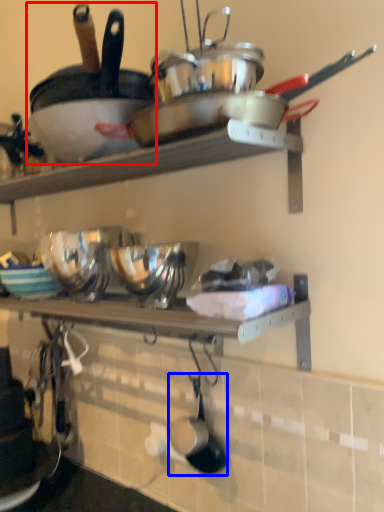
Question: Which object is closer to the camera taking this photo, frying pan (highlighted by a red box) or frying pan (highlighted by a blue box)?

Choices:
 (A) frying pan
 (B) frying pan

Answer: (A)